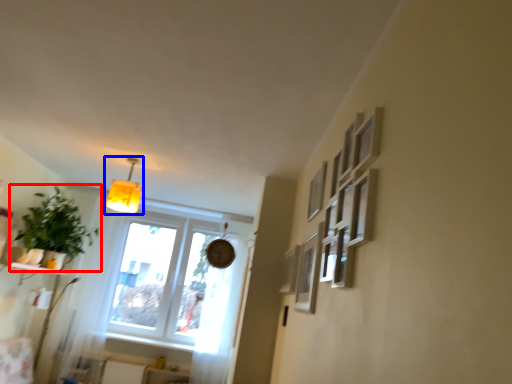
Question: Which point is closer to the camera, houseplant (highlighted by a red box) or lamp (highlighted by a blue box)?

Choices:
 (A) houseplant
 (B) lamp

Answer: (B)